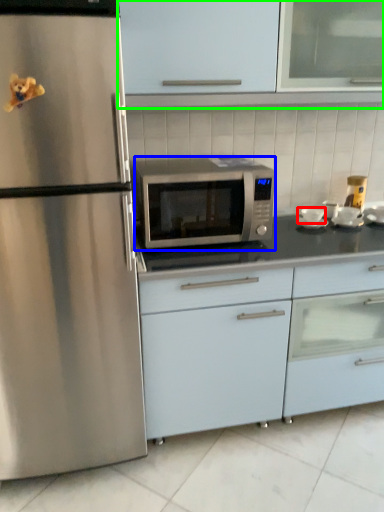
Question: Which object is the closest to the appliance (highlighted by a red box)? Choose among these: microwave oven (highlighted by a blue box) or cabinetry (highlighted by a green box).

Choices:
 (A) microwave oven
 (B) cabinetry

Answer: (A)